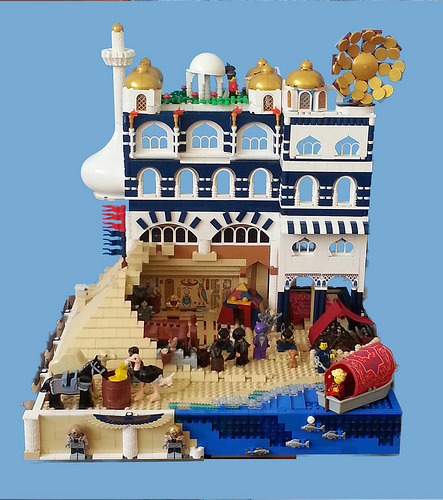
What are the coordinates of `toy fish` in the screenshot? It's located at (294, 442), (259, 449), (311, 425), (333, 436).